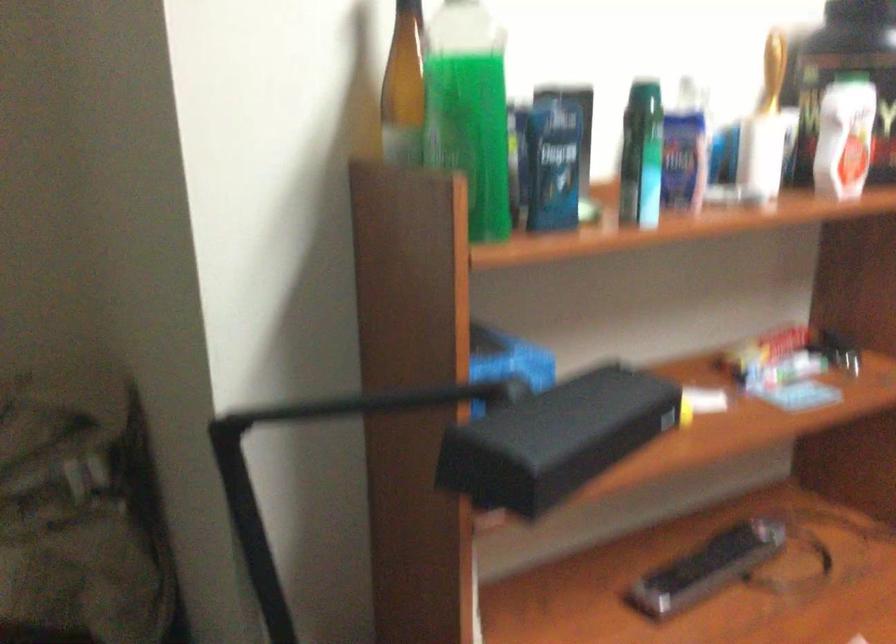
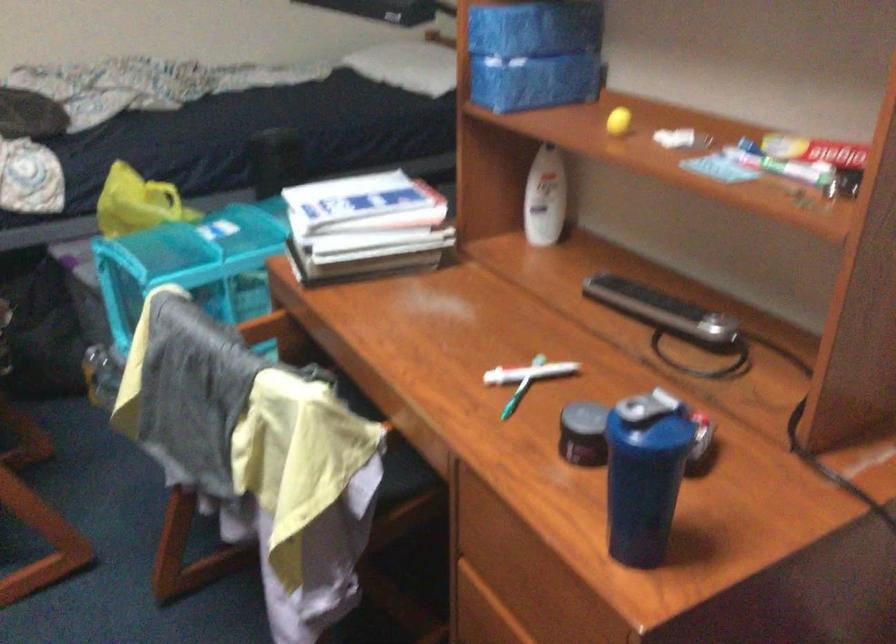
Where in the second image is the point corresponding to the point at 773,368 from the first image?

(780, 164)